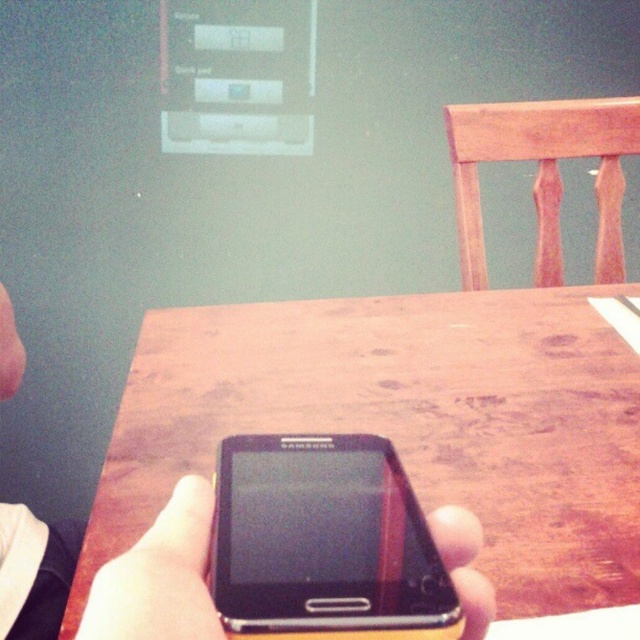
Does wooden table at center appear on the right side of skinny white skin at lower left?

Indeed, wooden table at center is positioned on the right side of skinny white skin at lower left.

Is wooden table at center thinner than skinny white skin at lower left?

In fact, wooden table at center might be wider than skinny white skin at lower left.

Locate an element on the screen. The width and height of the screenshot is (640, 640). wooden table at center is located at coordinates (406, 422).

At what (x,y) coordinates should I click in order to perform the action: click on wooden table at center. Please return your answer as a coordinate pair (x, y). This screenshot has height=640, width=640. Looking at the image, I should click on (406, 422).

Describe the element at coordinates (160, 577) in the screenshot. Image resolution: width=640 pixels, height=640 pixels. I see `black matte phone at center` at that location.

Locate an element on the screen. black matte phone at center is located at coordinates (160, 577).

Is point (628, 456) positioned in front of point (208, 525)?

No, it is behind (208, 525).

Which of these two, wooden table at center or black matte phone at center, stands shorter?

black matte phone at center

Measure the distance between wooden table at center and camera.

A distance of 46.18 centimeters exists between wooden table at center and camera.

Identify the location of wooden table at center. Image resolution: width=640 pixels, height=640 pixels. (406, 422).